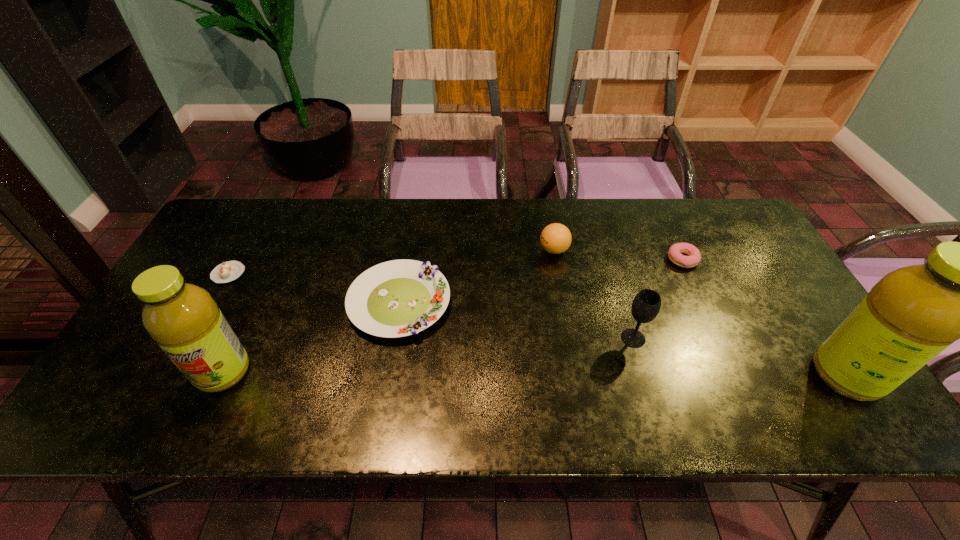
Please point a spot to place another fruit_juice for symmetrical spacing. Please provide its 2D coordinates. Your answer should be formatted as a tuple, i.e. [(x, y)], where the tuple contains the x and y coordinates of a point satisfying the conditions above.

[(534, 374)]